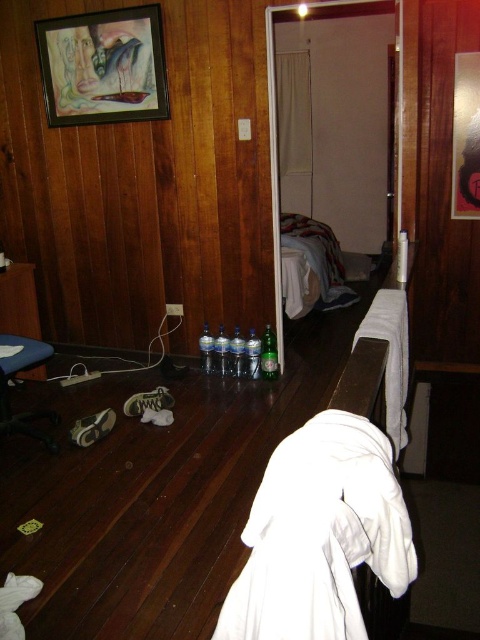
Find the location of `white soft robe at center`. white soft robe at center is located at coordinates (320, 534).

Does white soft robe at center appear under white fabric bed at center?

Yes, white soft robe at center is below white fabric bed at center.

Identify the location of white soft robe at center. (320, 534).

The height and width of the screenshot is (640, 480). I want to click on white soft robe at center, so click(x=320, y=534).

Is point (72, 100) closer to viewer compared to point (348, 292)?

Yes, it is in front of point (348, 292).

Which is below, matte black picture frame at upper left or white fabric bed at center?

white fabric bed at center is lower down.

This screenshot has height=640, width=480. What do you see at coordinates (103, 67) in the screenshot? I see `matte black picture frame at upper left` at bounding box center [103, 67].

Find the location of a particular element. The image size is (480, 640). matte black picture frame at upper left is located at coordinates (103, 67).

Between white soft robe at center and matte black picture frame at upper left, which one appears on the right side from the viewer's perspective?

white soft robe at center

Who is positioned more to the left, white soft robe at center or matte black picture frame at upper left?

From the viewer's perspective, matte black picture frame at upper left appears more on the left side.

Identify the location of white soft robe at center. The width and height of the screenshot is (480, 640). (320, 534).